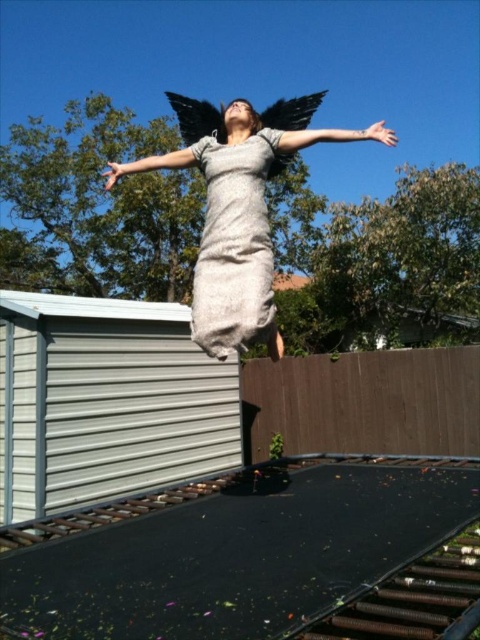
Who is more forward, (x=248, y=228) or (x=167, y=93)?

Point (x=248, y=228) is more forward.

Between gray matte dress at center and black matte wings at upper center, which one appears on the right side from the viewer's perspective?

Positioned to the right is gray matte dress at center.

Is point (294, 125) farther from camera compared to point (217, 120)?

No, it is not.

Where is `gray matte dress at center`? The image size is (480, 640). gray matte dress at center is located at coordinates (239, 208).

Does point (216, 348) come behind point (313, 141)?

No, it is not.

Who is taller, gray textured dress at center or matte gray arm at upper center?

Standing taller between the two is matte gray arm at upper center.

Which is behind, point (207, 148) or point (324, 132)?

Point (207, 148)

Find the location of a particular element. The width and height of the screenshot is (480, 640). gray textured dress at center is located at coordinates (233, 246).

Is matte gray arm at upper center wider than gray matte fabric at upper center?

Indeed, matte gray arm at upper center has a greater width compared to gray matte fabric at upper center.

The width and height of the screenshot is (480, 640). I want to click on matte gray arm at upper center, so click(x=334, y=136).

You are a GUI agent. You are given a task and a screenshot of the screen. Output one action in this format:
    pyautogui.click(x=<x>, y=<y>)
    Task: Click on the matte gray arm at upper center
    
    Given the screenshot: What is the action you would take?
    [334, 136]